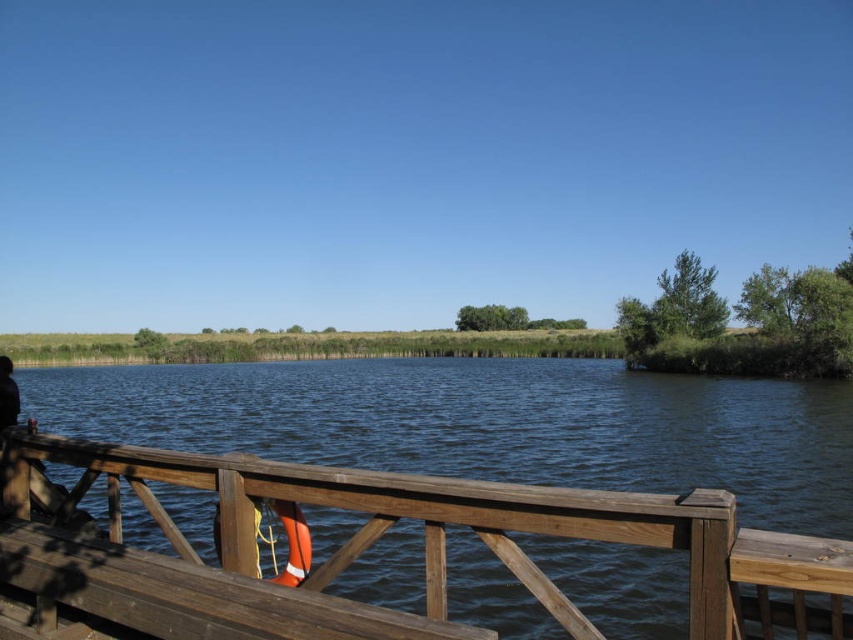
Locate an element on the screen. The height and width of the screenshot is (640, 853). brown wooden rail at lower center is located at coordinates click(376, 540).

Can you confirm if brown wooden rail at lower center is smaller than orange fabric life jacket at lower center?

No, brown wooden rail at lower center is not smaller than orange fabric life jacket at lower center.

Find the location of `brown wooden rail at lower center`. brown wooden rail at lower center is located at coordinates click(376, 540).

Locate an element on the screen. brown wooden rail at lower center is located at coordinates (376, 540).